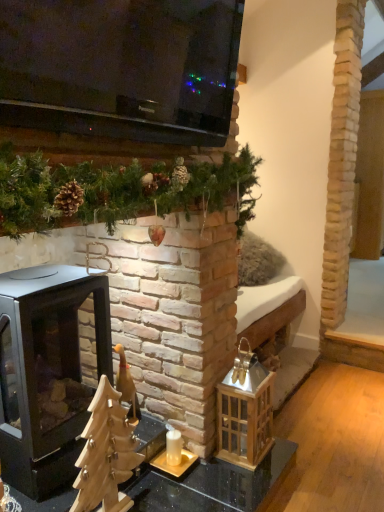
The height and width of the screenshot is (512, 384). I want to click on unoccupied area in front of gold metallic candle holder at center, so point(182,486).